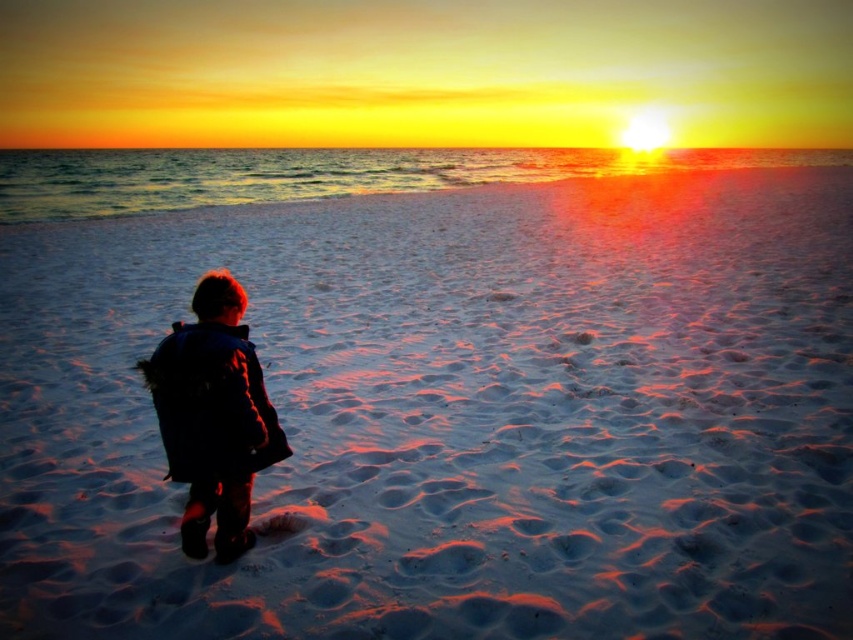
Question: Is white sandy beach at center smaller than dark blue jacket at lower left?

Choices:
 (A) yes
 (B) no

Answer: (B)

Question: Is white sandy beach at center bigger than dark blue jacket at lower left?

Choices:
 (A) yes
 (B) no

Answer: (A)

Question: Which point is farther from the camera taking this photo?

Choices:
 (A) (796, 376)
 (B) (238, 396)

Answer: (A)

Question: Which of the following is the closest to the observer?

Choices:
 (A) (222, 413)
 (B) (39, 572)

Answer: (A)

Question: From the image, what is the correct spatial relationship of white sandy beach at center in relation to dark blue jacket at lower left?

Choices:
 (A) right
 (B) left

Answer: (A)

Question: Among these objects, which one is farthest from the camera?

Choices:
 (A) white sandy beach at center
 (B) dark blue jacket at lower left

Answer: (A)